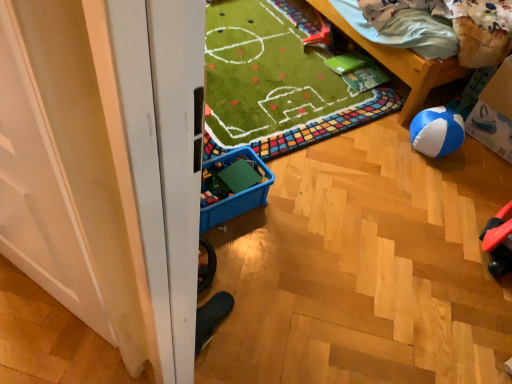
Question: Can you confirm if wooden bed at upper right is taller than rubberized plastic toy at upper center?

Choices:
 (A) yes
 (B) no

Answer: (A)

Question: From the image's perspective, is wooden bed at upper right beneath rubberized plastic toy at upper center?

Choices:
 (A) yes
 (B) no

Answer: (B)

Question: Is wooden bed at upper right positioned in front of rubberized plastic toy at upper center?

Choices:
 (A) no
 (B) yes

Answer: (B)

Question: Is rubberized plastic toy at upper center at the back of wooden bed at upper right?

Choices:
 (A) yes
 (B) no

Answer: (B)

Question: Could you tell me if wooden bed at upper right is turned towards rubberized plastic toy at upper center?

Choices:
 (A) no
 (B) yes

Answer: (A)

Question: From the image's perspective, is wooden bed at upper right positioned above or below cardboard box at right?

Choices:
 (A) below
 (B) above

Answer: (B)

Question: Based on their sizes in the image, would you say wooden bed at upper right is bigger or smaller than cardboard box at right?

Choices:
 (A) small
 (B) big

Answer: (B)

Question: In terms of width, does wooden bed at upper right look wider or thinner when compared to cardboard box at right?

Choices:
 (A) wide
 (B) thin

Answer: (A)

Question: Is point (401, 79) positioned closer to the camera than point (487, 99)?

Choices:
 (A) closer
 (B) farther

Answer: (B)

Question: Is point (500, 135) positioned closer to the camera than point (357, 43)?

Choices:
 (A) farther
 (B) closer

Answer: (B)

Question: Would you say cardboard box at right is inside or outside wooden bed at upper right?

Choices:
 (A) outside
 (B) inside

Answer: (A)

Question: Based on their positions, is cardboard box at right located to the left or right of wooden bed at upper right?

Choices:
 (A) right
 (B) left

Answer: (A)

Question: From the image's perspective, is cardboard box at right above or below wooden bed at upper right?

Choices:
 (A) above
 (B) below

Answer: (B)

Question: From a real-world perspective, relative to blue plastic storage box at center, is cardboard box at right vertically above or below?

Choices:
 (A) below
 (B) above

Answer: (B)

Question: From the image's perspective, is cardboard box at right located above or below blue plastic storage box at center?

Choices:
 (A) above
 (B) below

Answer: (A)